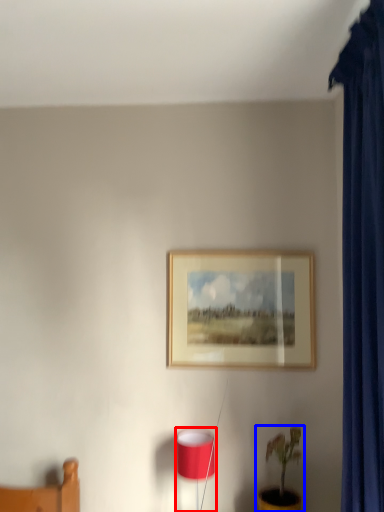
Question: Which point is further to the camera, table lamp (highlighted by a red box) or houseplant (highlighted by a blue box)?

Choices:
 (A) table lamp
 (B) houseplant

Answer: (A)